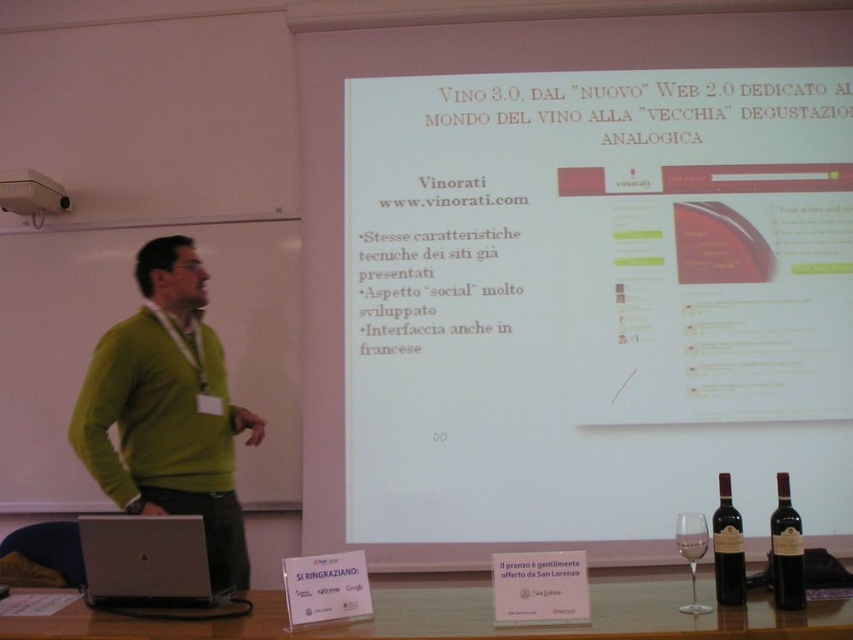
Question: Does dark glass bottle at lower right appear on the left side of dark red glass bottle at lower right?

Choices:
 (A) no
 (B) yes

Answer: (A)

Question: Can you confirm if silver metallic laptop at lower left is bigger than dark glass bottle at lower right?

Choices:
 (A) yes
 (B) no

Answer: (A)

Question: In this image, where is white matte projection screen at upper center located relative to clear glass at center?

Choices:
 (A) above
 (B) below

Answer: (A)

Question: Which of the following is the closest to the observer?

Choices:
 (A) (798, 572)
 (B) (10, 195)
 (C) (135, 458)
 (D) (686, 541)

Answer: (A)

Question: Which object appears closest to the camera in this image?

Choices:
 (A) transparent glass at lower center
 (B) white matte projection screen at upper center
 (C) silver metallic laptop at lower left

Answer: (A)

Question: Which is nearer to the clear glass at center?

Choices:
 (A) transparent glass at lower center
 (B) white plastic projector at upper left
 (C) dark glass bottle at lower right

Answer: (A)